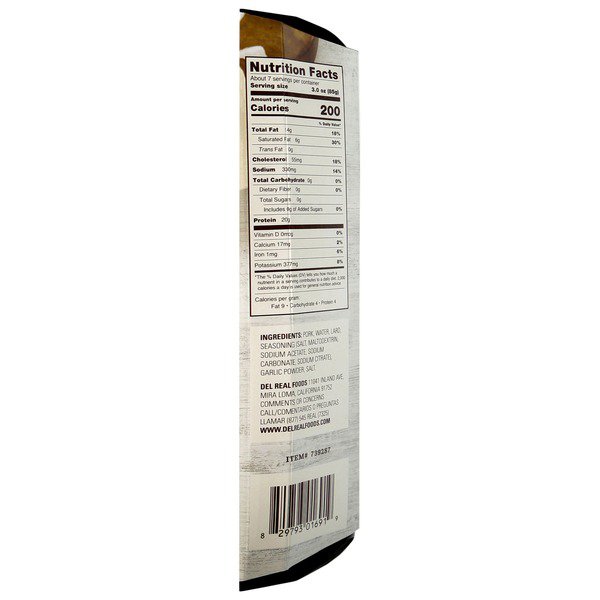
Identify the location of box. The height and width of the screenshot is (600, 600). (350, 78).